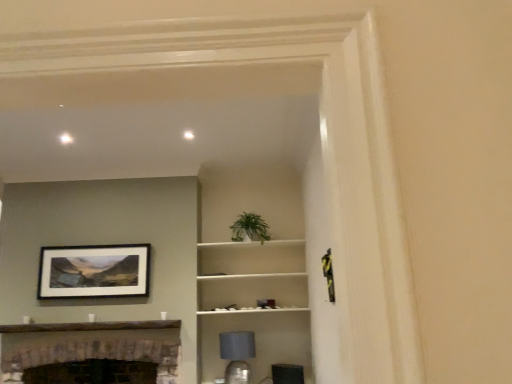
Question: Does matte gray lampshade at lower center have a greater height compared to brick fireplace at lower left?

Choices:
 (A) no
 (B) yes

Answer: (A)

Question: From the image's perspective, is matte gray lampshade at lower center under brick fireplace at lower left?

Choices:
 (A) no
 (B) yes

Answer: (A)

Question: Could you tell me if matte gray lampshade at lower center is facing brick fireplace at lower left?

Choices:
 (A) yes
 (B) no

Answer: (B)

Question: From the image's perspective, would you say matte gray lampshade at lower center is positioned over brick fireplace at lower left?

Choices:
 (A) yes
 (B) no

Answer: (A)

Question: From a real-world perspective, does matte gray lampshade at lower center sit lower than brick fireplace at lower left?

Choices:
 (A) yes
 (B) no

Answer: (A)

Question: Considering the positions of green leafy plant at center and brick fireplace at lower left in the image, is green leafy plant at center taller or shorter than brick fireplace at lower left?

Choices:
 (A) tall
 (B) short

Answer: (B)

Question: Looking at their shapes, would you say green leafy plant at center is wider or thinner than brick fireplace at lower left?

Choices:
 (A) thin
 (B) wide

Answer: (A)

Question: In the image, is green leafy plant at center on the left side or the right side of brick fireplace at lower left?

Choices:
 (A) left
 (B) right

Answer: (B)

Question: Considering the positions of green leafy plant at center and brick fireplace at lower left in the image, is green leafy plant at center bigger or smaller than brick fireplace at lower left?

Choices:
 (A) big
 (B) small

Answer: (B)

Question: Considering the positions of white matte shelf at center and green leafy plant at center in the image, is white matte shelf at center bigger or smaller than green leafy plant at center?

Choices:
 (A) big
 (B) small

Answer: (A)

Question: From the image's perspective, is white matte shelf at center above or below green leafy plant at center?

Choices:
 (A) below
 (B) above

Answer: (A)

Question: Relative to green leafy plant at center, is white matte shelf at center in front or behind?

Choices:
 (A) behind
 (B) front

Answer: (B)

Question: Is point (289, 296) closer or farther from the camera than point (245, 215)?

Choices:
 (A) farther
 (B) closer

Answer: (B)

Question: Does point (284, 283) appear closer or farther from the camera than point (65, 339)?

Choices:
 (A) closer
 (B) farther

Answer: (B)

Question: Is white matte shelf at center in front of or behind brick fireplace at lower left in the image?

Choices:
 (A) behind
 (B) front

Answer: (A)